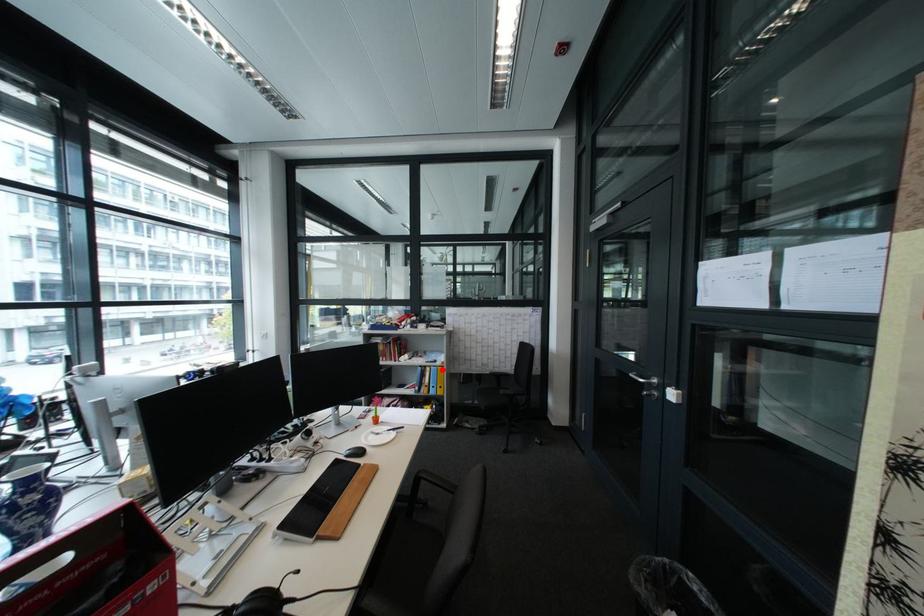
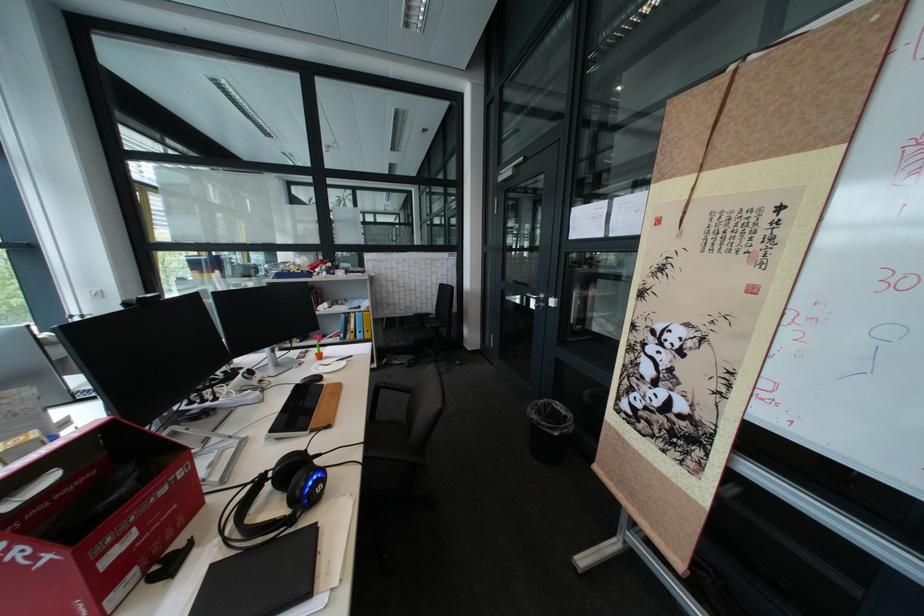
Find the pixel in the second image that matches the highlighted location in the first image.

(367, 315)